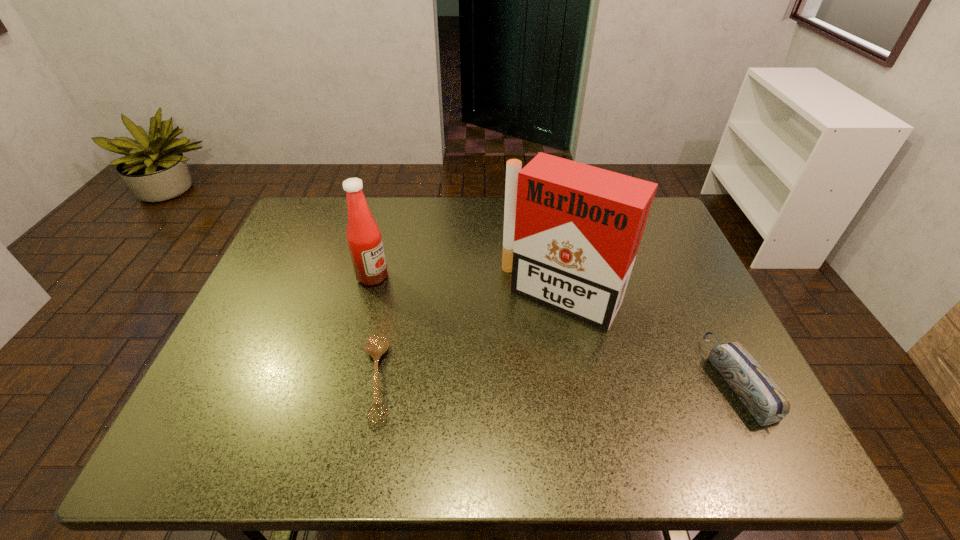
You are a GUI agent. You are given a task and a screenshot of the screen. Output one action in this format:
    pyautogui.click(x=<x>, y=<y>)
    Task: Click on the free space on the desktop that is between the ladle and the rightmost object and is positioned on the front-facing side of the tallest object
    The width and height of the screenshot is (960, 540).
    Given the screenshot: What is the action you would take?
    pyautogui.click(x=505, y=380)

This screenshot has width=960, height=540. Find the location of `vacant space on the desktop that is between the shortest object and the rightmost object and is positioned on the front-facing side of the condiment`. vacant space on the desktop that is between the shortest object and the rightmost object and is positioned on the front-facing side of the condiment is located at coordinates (564, 380).